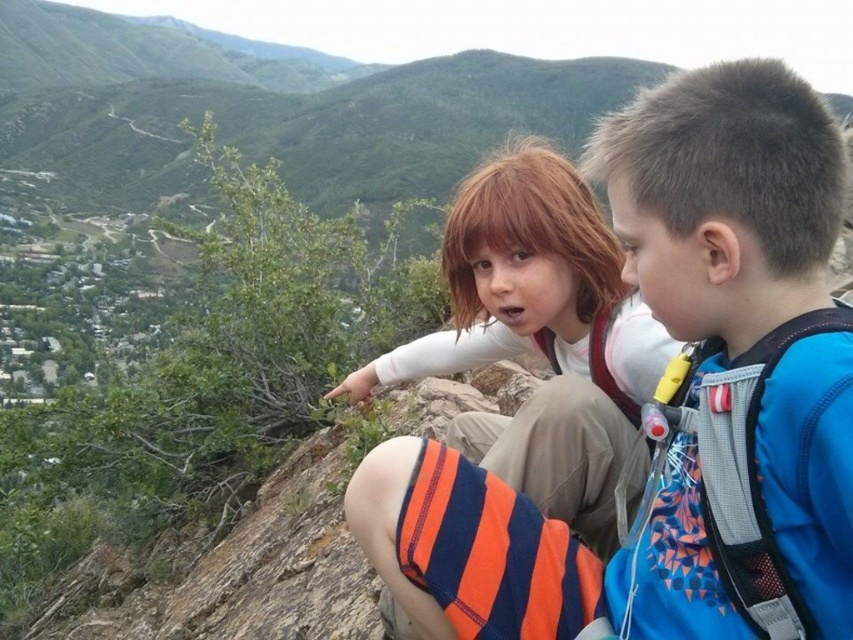
Question: Is blue fabric backpack at upper right smaller than white cotton shirt at center?

Choices:
 (A) yes
 (B) no

Answer: (A)

Question: Which object appears closest to the camera in this image?

Choices:
 (A) white cotton shirt at center
 (B) blue fabric backpack at upper right

Answer: (B)

Question: Does blue fabric backpack at upper right come in front of white cotton shirt at center?

Choices:
 (A) no
 (B) yes

Answer: (B)

Question: Which point is closer to the camera?

Choices:
 (A) (578, 428)
 (B) (666, 324)

Answer: (B)

Question: Which point appears closest to the camera in this image?

Choices:
 (A) (585, 480)
 (B) (712, 440)

Answer: (B)

Question: Can you confirm if blue fabric backpack at upper right is bigger than white cotton shirt at center?

Choices:
 (A) no
 (B) yes

Answer: (A)